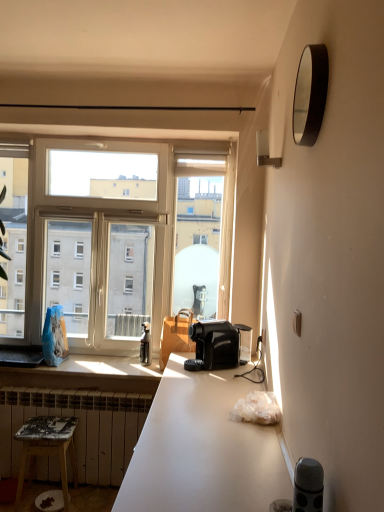
Question: Can you confirm if brown leather handbag at window is shorter than black glossy mirror at upper right?

Choices:
 (A) yes
 (B) no

Answer: (B)

Question: Are brown leather handbag at window and black glossy mirror at upper right making contact?

Choices:
 (A) yes
 (B) no

Answer: (B)

Question: Does brown leather handbag at window appear on the right side of black glossy mirror at upper right?

Choices:
 (A) no
 (B) yes

Answer: (A)

Question: Is brown leather handbag at window thinner than black glossy mirror at upper right?

Choices:
 (A) yes
 (B) no

Answer: (B)

Question: Does brown leather handbag at window have a smaller size compared to black glossy mirror at upper right?

Choices:
 (A) yes
 (B) no

Answer: (B)

Question: Is brown leather handbag at window outside of black glossy mirror at upper right?

Choices:
 (A) yes
 (B) no

Answer: (A)

Question: Is white frosted glass wall sconce at upper right facing towards clear glass window at center?

Choices:
 (A) no
 (B) yes

Answer: (A)

Question: From a real-world perspective, is white frosted glass wall sconce at upper right over clear glass window at center?

Choices:
 (A) yes
 (B) no

Answer: (A)

Question: From a real-world perspective, is white frosted glass wall sconce at upper right located beneath clear glass window at center?

Choices:
 (A) yes
 (B) no

Answer: (B)

Question: From the image's perspective, is white frosted glass wall sconce at upper right on clear glass window at center?

Choices:
 (A) no
 (B) yes

Answer: (B)

Question: Is clear glass window at center at the back of white frosted glass wall sconce at upper right?

Choices:
 (A) no
 (B) yes

Answer: (A)

Question: Does white frosted glass wall sconce at upper right have a smaller size compared to clear glass window at center?

Choices:
 (A) yes
 (B) no

Answer: (A)

Question: Is the depth of white painted metal radiator at lower left greater than that of clear glass window at center?

Choices:
 (A) no
 (B) yes

Answer: (A)